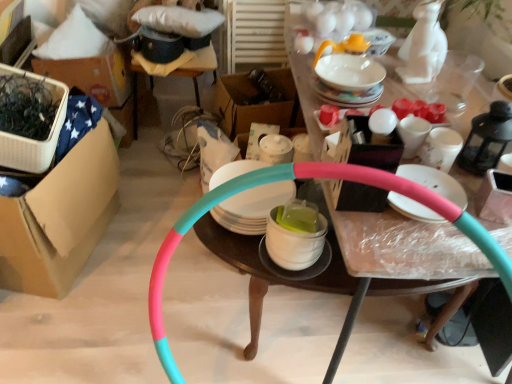
Question: Can you confirm if matte white plate at center, which ranks as the third tableware in bottom-to-top order, is thinner than white glossy mug at center, the fifth tableware from the bottom?

Choices:
 (A) no
 (B) yes

Answer: (A)

Question: Is matte white plate at center, arranged as the sixth tableware when viewed from the top, placed right next to white glossy mug at center, the fifth tableware from the bottom?

Choices:
 (A) no
 (B) yes

Answer: (A)

Question: Considering the relative positions of matte white plate at center, which ranks as the third tableware in bottom-to-top order, and white glossy mug at center, which appears as the 4th tableware when viewed from the top, in the image provided, is matte white plate at center, which ranks as the third tableware in bottom-to-top order, in front of white glossy mug at center, which appears as the 4th tableware when viewed from the top,?

Choices:
 (A) no
 (B) yes

Answer: (B)

Question: From a real-world perspective, is matte white plate at center, which ranks as the third tableware in bottom-to-top order, positioned over white glossy mug at center, which appears as the 4th tableware when viewed from the top, based on gravity?

Choices:
 (A) yes
 (B) no

Answer: (A)

Question: Considering the relative sizes of matte white plate at center, arranged as the sixth tableware when viewed from the top, and white glossy mug at center, which appears as the 4th tableware when viewed from the top, in the image provided, is matte white plate at center, arranged as the sixth tableware when viewed from the top, shorter than white glossy mug at center, which appears as the 4th tableware when viewed from the top,?

Choices:
 (A) no
 (B) yes

Answer: (B)

Question: Considering the positions of white glossy mug at upper right, placed as the third tableware when sorted from top to bottom, and white glossy bowl at center, acting as the first tableware starting from the bottom, in the image, is white glossy mug at upper right, placed as the third tableware when sorted from top to bottom, taller or shorter than white glossy bowl at center, acting as the first tableware starting from the bottom,?

Choices:
 (A) tall
 (B) short

Answer: (B)

Question: Which is correct: white glossy mug at upper right, which appears as the sixth tableware when ordered from the bottom, is inside white glossy bowl at center, the 8th tableware viewed from the top, or outside of it?

Choices:
 (A) outside
 (B) inside

Answer: (A)

Question: Is white glossy mug at upper right, which appears as the sixth tableware when ordered from the bottom, wider or thinner than white glossy bowl at center, acting as the first tableware starting from the bottom?

Choices:
 (A) wide
 (B) thin

Answer: (B)

Question: Considering the positions of point (400, 125) and point (305, 266), is point (400, 125) closer or farther from the camera than point (305, 266)?

Choices:
 (A) farther
 (B) closer

Answer: (A)

Question: From a real-world perspective, is white glossy bowl at center, acting as the first tableware starting from the bottom, above or below white glossy plate at center, acting as the 2th tableware starting from the bottom?

Choices:
 (A) above
 (B) below

Answer: (A)

Question: In terms of size, does white glossy bowl at center, the 8th tableware viewed from the top, appear bigger or smaller than white glossy plate at center, acting as the 2th tableware starting from the bottom?

Choices:
 (A) small
 (B) big

Answer: (A)

Question: In terms of width, does white glossy bowl at center, acting as the first tableware starting from the bottom, look wider or thinner when compared to white glossy plate at center, acting as the 2th tableware starting from the bottom?

Choices:
 (A) thin
 (B) wide

Answer: (A)

Question: Considering the positions of white glossy bowl at center, the 8th tableware viewed from the top, and white glossy plate at center, the 7th tableware when ordered from top to bottom, in the image, is white glossy bowl at center, the 8th tableware viewed from the top, taller or shorter than white glossy plate at center, the 7th tableware when ordered from top to bottom,?

Choices:
 (A) short
 (B) tall

Answer: (B)

Question: Considering their positions, is white glossy mug at upper right, placed as the third tableware when sorted from top to bottom, located in front of or behind white glossy mug at upper right, arranged as the 4th tableware when ordered from the bottom?

Choices:
 (A) front
 (B) behind

Answer: (B)

Question: Visually, is white glossy mug at upper right, placed as the third tableware when sorted from top to bottom, positioned to the left or to the right of white glossy mug at upper right, the fifth tableware positioned from the top?

Choices:
 (A) right
 (B) left

Answer: (B)